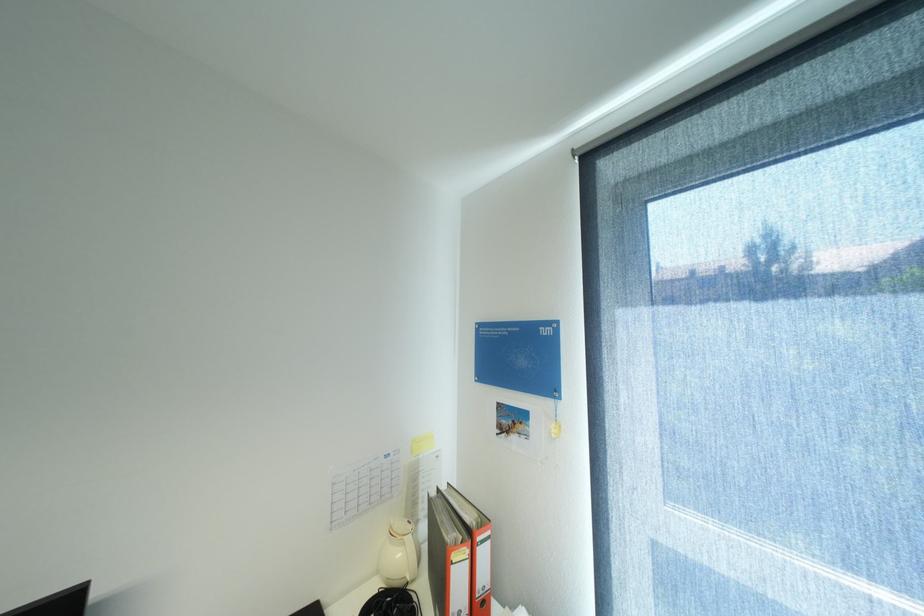
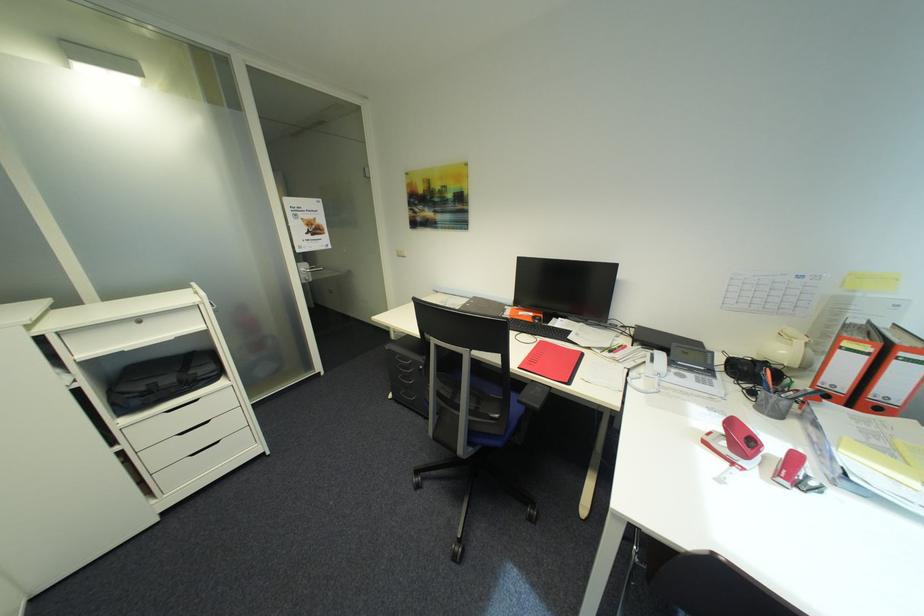
In the second image, find the point that corresponds to (492,556) in the first image.

(912, 371)